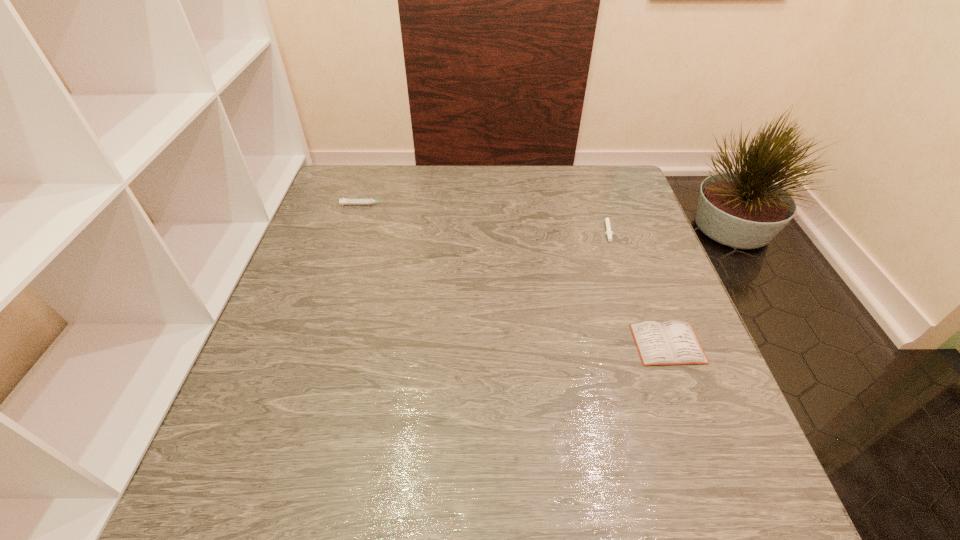
Identify the location of syringe that is at the right edge. (608, 232).

Where is `diary positioned at the right edge`? diary positioned at the right edge is located at coordinates (672, 342).

Where is `object that is at the far left corner`? object that is at the far left corner is located at coordinates [x=361, y=201].

Image resolution: width=960 pixels, height=540 pixels. What are the coordinates of `vacant region at the far edge of the desktop` in the screenshot? It's located at (522, 166).

Identify the location of free spot at the near edge of the desktop. The height and width of the screenshot is (540, 960). (359, 518).

In the image, there is a desktop. Find the location of `vacant space at the left edge`. vacant space at the left edge is located at coordinates (287, 340).

Locate an element on the screen. free space at the right edge is located at coordinates (679, 367).

Locate an element on the screen. Image resolution: width=960 pixels, height=540 pixels. vacant space at the far left corner of the desktop is located at coordinates (327, 190).

Locate an element on the screen. This screenshot has width=960, height=540. free spot at the near right corner of the desktop is located at coordinates (x=665, y=484).

The width and height of the screenshot is (960, 540). Find the location of `vacant space in between the nearer syringe and the diary`. vacant space in between the nearer syringe and the diary is located at coordinates (637, 286).